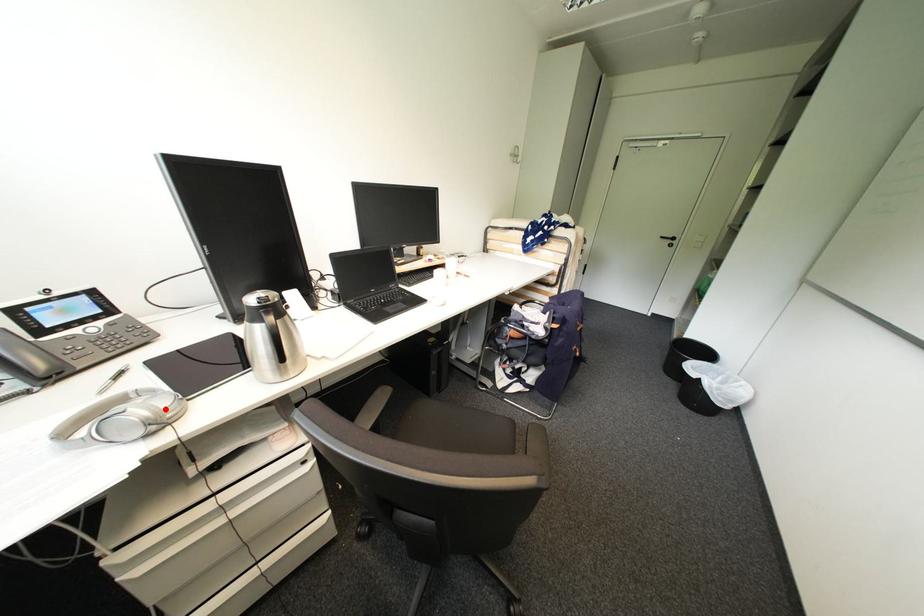
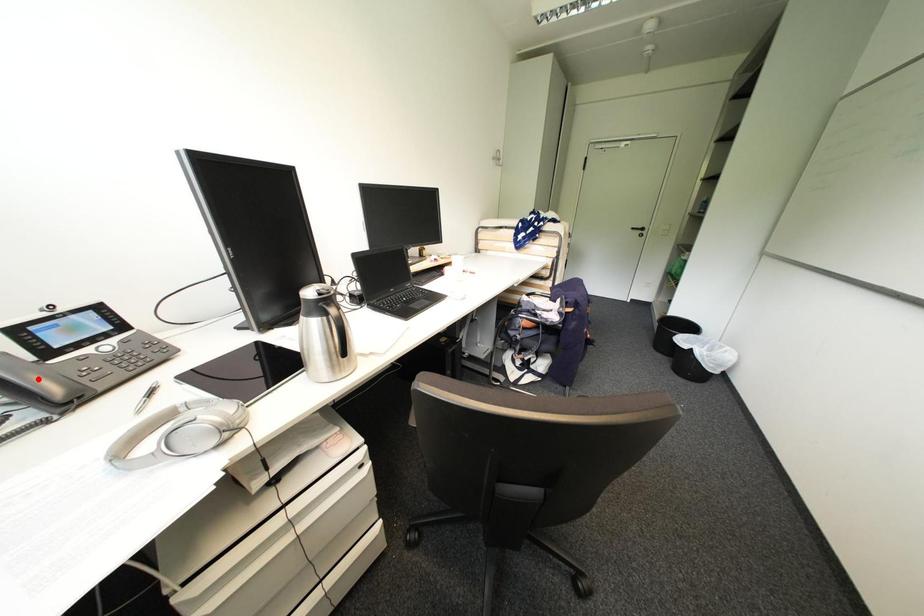
I am providing you with two images of the same scene from different viewpoints. A red point is marked on the first image and another point is marked on the second image. Is the red point in image1 aligned with the point shown in image2?

No